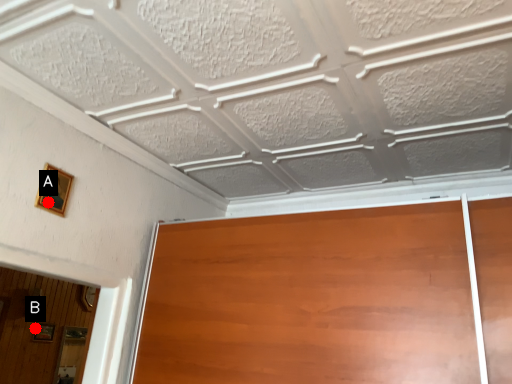
Question: Two points are circled on the image, labeled by A and B beside each circle. Which of the following is the closest to the observer?

Choices:
 (A) A is closer
 (B) B is closer

Answer: (A)